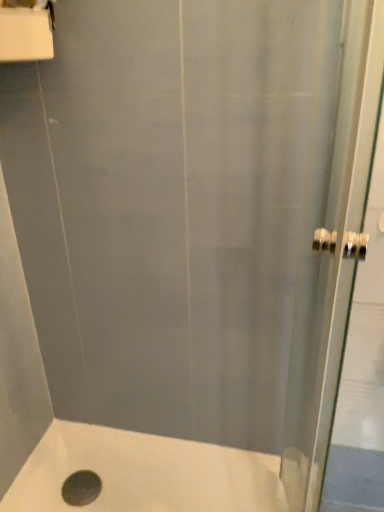
Question: Should I look upward or downward to see white matte bath at lower left?

Choices:
 (A) up
 (B) down

Answer: (B)